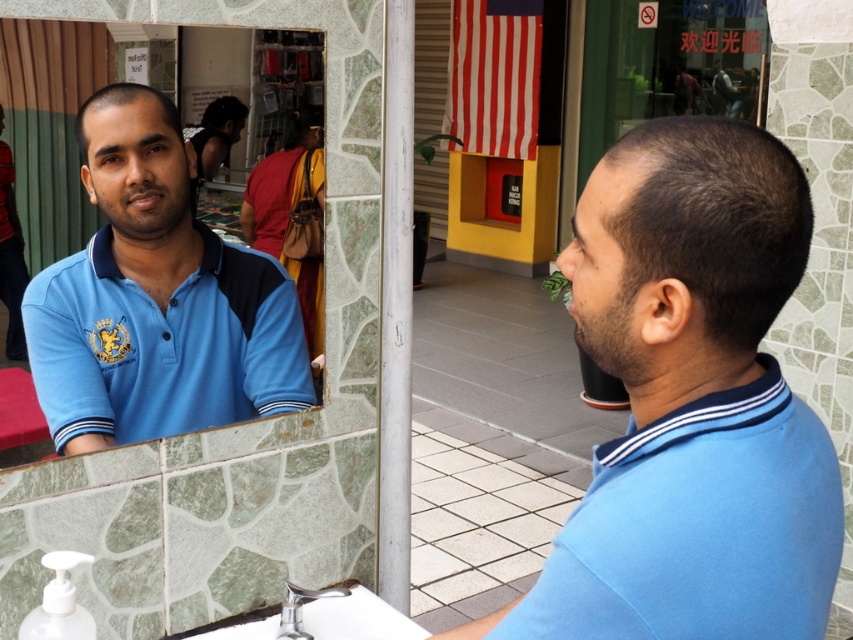
Which is above, silver metallic faucet at lower center or chrome metallic faucet at lower center?

silver metallic faucet at lower center is higher up.

Does silver metallic faucet at lower center appear on the left side of chrome metallic faucet at lower center?

Indeed, silver metallic faucet at lower center is positioned on the left side of chrome metallic faucet at lower center.

Which is behind, point (412, 634) or point (340, 589)?

The point (340, 589) is behind.

The height and width of the screenshot is (640, 853). In order to click on silver metallic faucet at lower center in this screenshot , I will do `click(315, 620)`.

Who is positioned more to the left, blue cotton shirt at center or matte blue polo shirt at right?

Positioned to the left is blue cotton shirt at center.

Between blue cotton shirt at center and matte blue polo shirt at right, which one is positioned higher?

blue cotton shirt at center

Find the location of a particular element. blue cotton shirt at center is located at coordinates (689, 403).

Which is above, blue matte shirt at left or chrome metallic faucet at lower center?

blue matte shirt at left

Does point (91, 365) come closer to viewer compared to point (303, 592)?

Yes, it is in front of point (303, 592).

Locate an element on the screen. The image size is (853, 640). blue matte shirt at left is located at coordinates (155, 300).